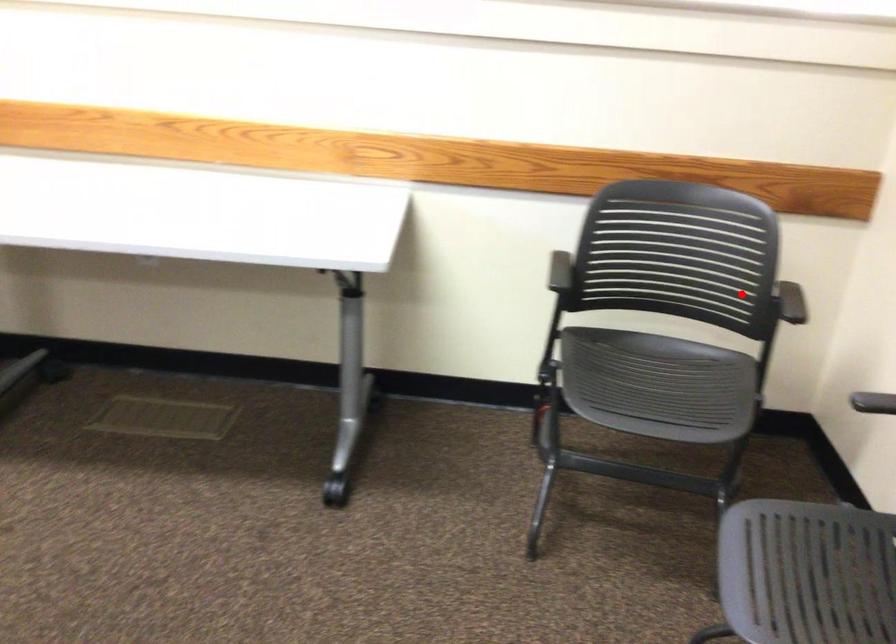
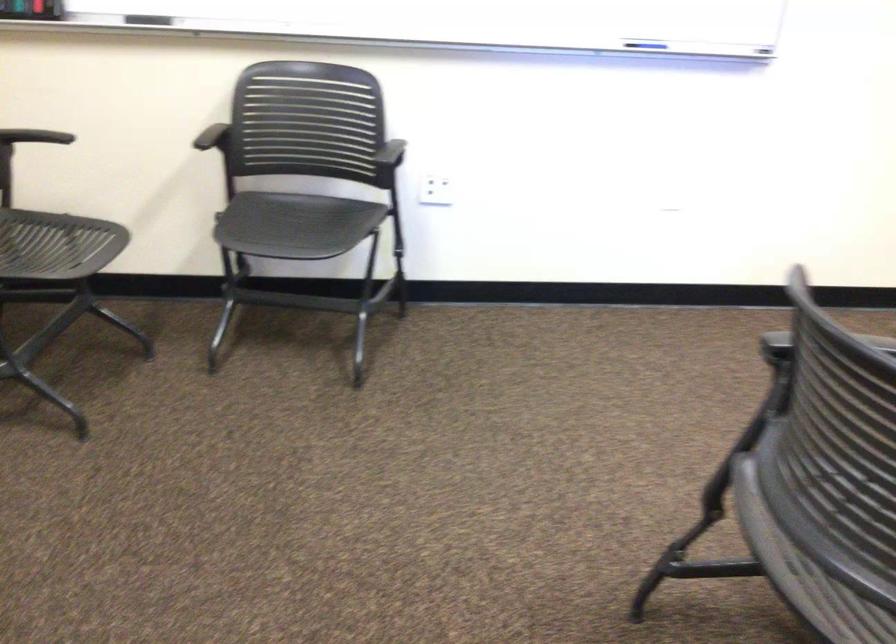
The point at the highlighted location is marked in the first image. Where is the corresponding point in the second image?

(35, 136)